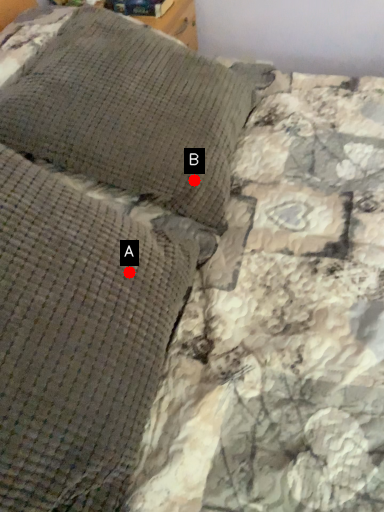
Question: Two points are circled on the image, labeled by A and B beside each circle. Which point is farther from the camera taking this photo?

Choices:
 (A) A is further
 (B) B is further

Answer: (B)